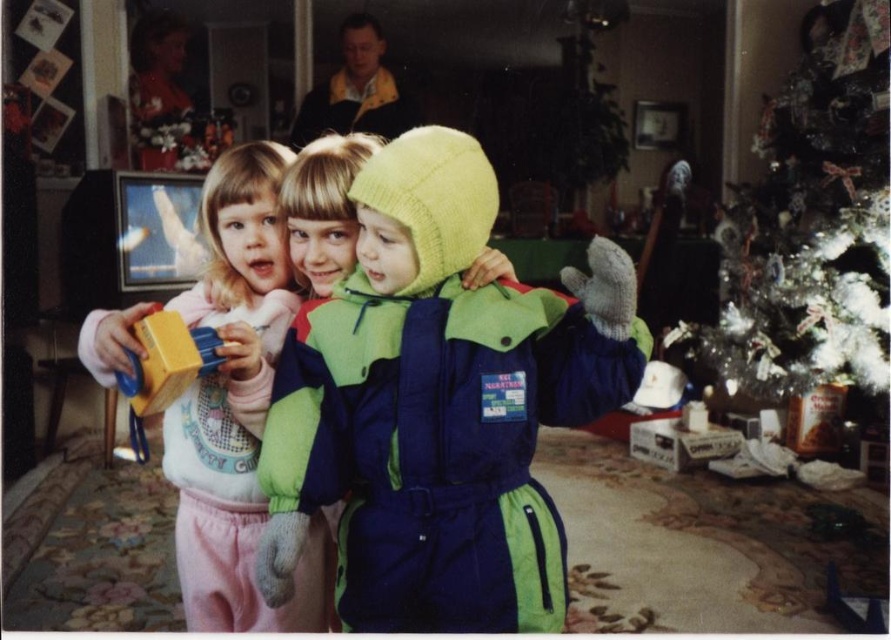
Based on the scene description, where is the multicolored fleece snowsuit at center located in terms of coordinates?

The multicolored fleece snowsuit at center is located at coordinates point (439, 404).

You are a photographer setting up for a family photo. You need to position a light source to the left of the matte pink pants at center to highlight the multicolored fleece snowsuit at center. Is the light source placement possible without moving the children?

Yes, the light source can be placed to the left of the matte pink pants at center because the multicolored fleece snowsuit at center is already positioned to the right of the matte pink pants at center, so the light will naturally illuminate it.

You are a parent trying to organize toys in the living room. You see the multicolored fleece snowsuit at center and the matte yellow block at center. Which toy should you place to the left if you want to follow the current arrangement?

You should place the matte yellow block at center to the left because the multicolored fleece snowsuit at center is positioned on the right side of it.